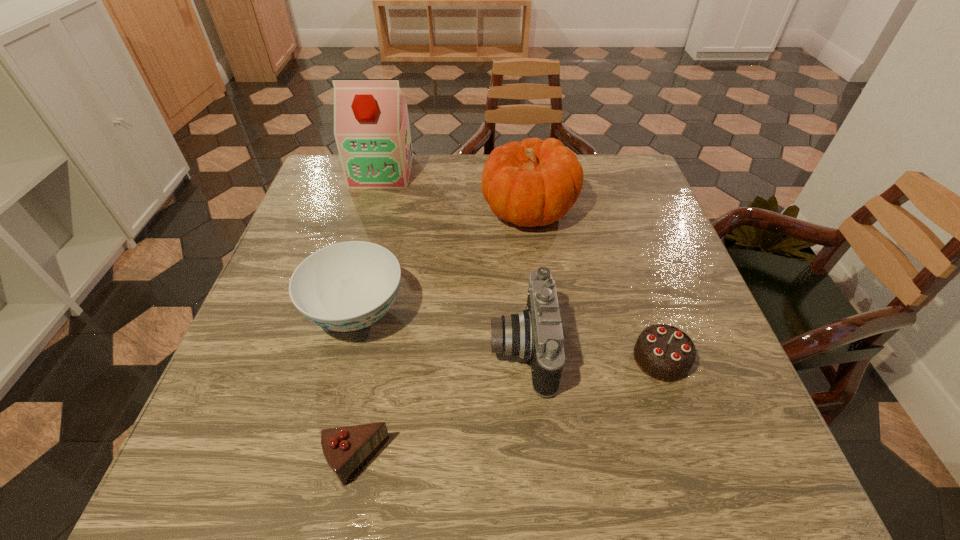
Identify the location of vacant space situated on the front-facing side of the fourth shortest object. (292, 348).

What are the coordinates of `vacant space positioned on the front-facing side of the fourth shortest object` in the screenshot? It's located at (307, 348).

Locate an element on the screen. Image resolution: width=960 pixels, height=540 pixels. free space located 0.240m on the front-facing side of the fourth shortest object is located at coordinates (369, 348).

The width and height of the screenshot is (960, 540). Find the location of `vacant space situated 0.240m on the back of the third shortest object`. vacant space situated 0.240m on the back of the third shortest object is located at coordinates (382, 212).

This screenshot has height=540, width=960. In order to click on free space located on the left of the rightmost object in this screenshot , I will do `click(472, 359)`.

This screenshot has width=960, height=540. I want to click on vacant space positioned on the back of the left chocolate cake, so click(x=387, y=301).

The height and width of the screenshot is (540, 960). What are the coordinates of `soya milk located in the far edge section of the desktop` in the screenshot? It's located at (371, 126).

This screenshot has height=540, width=960. I want to click on pumpkin at the far edge, so click(533, 183).

At what (x,y) coordinates should I click in order to perform the action: click on object located in the near edge section of the desktop. Please return your answer as a coordinate pair (x, y). The height and width of the screenshot is (540, 960). Looking at the image, I should click on (346, 449).

Identify the location of soya milk present at the left edge. (371, 126).